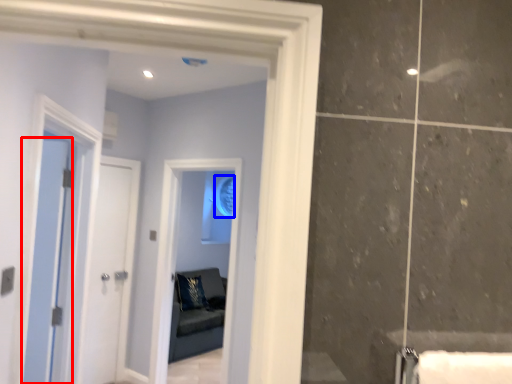
Question: Which object is further to the camera taking this photo, door (highlighted by a red box) or mirror (highlighted by a blue box)?

Choices:
 (A) door
 (B) mirror

Answer: (B)